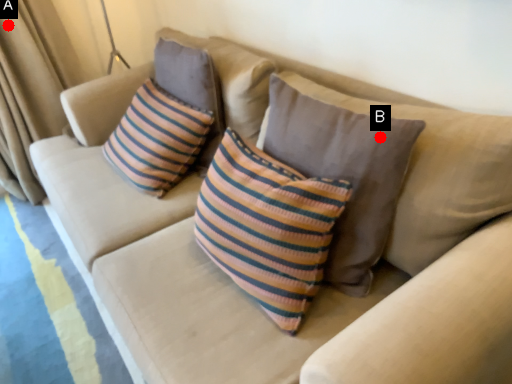
Question: Two points are circled on the image, labeled by A and B beside each circle. Which point appears closest to the camera in this image?

Choices:
 (A) A is closer
 (B) B is closer

Answer: (B)